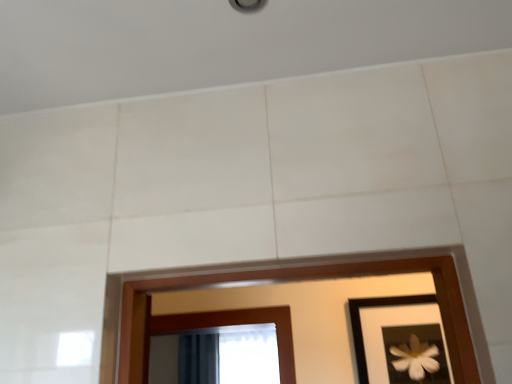
Question: Is black matte picture frame at lower right positioned beyond the bounds of dark blue fabric at lower center?

Choices:
 (A) no
 (B) yes

Answer: (B)

Question: Is black matte picture frame at lower right surrounding dark blue fabric at lower center?

Choices:
 (A) no
 (B) yes

Answer: (A)

Question: Can you confirm if black matte picture frame at lower right is smaller than dark blue fabric at lower center?

Choices:
 (A) no
 (B) yes

Answer: (B)

Question: Is black matte picture frame at lower right aimed at dark blue fabric at lower center?

Choices:
 (A) no
 (B) yes

Answer: (A)

Question: Can you confirm if black matte picture frame at lower right is wider than dark blue fabric at lower center?

Choices:
 (A) no
 (B) yes

Answer: (A)

Question: Is black matte picture frame at lower right not near dark blue fabric at lower center?

Choices:
 (A) no
 (B) yes

Answer: (A)

Question: Would you say dark blue fabric at lower center contains black matte picture frame at lower right?

Choices:
 (A) yes
 (B) no

Answer: (B)

Question: Is dark blue fabric at lower center at the right side of black matte picture frame at lower right?

Choices:
 (A) yes
 (B) no

Answer: (B)

Question: Is dark blue fabric at lower center not near black matte picture frame at lower right?

Choices:
 (A) no
 (B) yes

Answer: (A)

Question: From the image's perspective, does dark blue fabric at lower center appear lower than black matte picture frame at lower right?

Choices:
 (A) yes
 (B) no

Answer: (A)

Question: Could you tell me if dark blue fabric at lower center is facing black matte picture frame at lower right?

Choices:
 (A) no
 (B) yes

Answer: (A)

Question: Does dark blue fabric at lower center come behind black matte picture frame at lower right?

Choices:
 (A) no
 (B) yes

Answer: (B)

Question: Which is correct: black matte picture frame at lower right is inside dark blue fabric at lower center, or outside of it?

Choices:
 (A) inside
 (B) outside

Answer: (B)